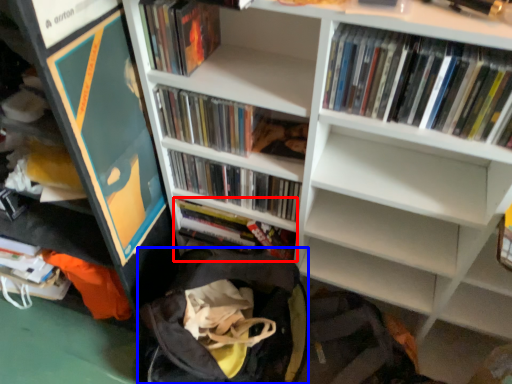
Question: Among these objects, which one is nearest to the camera, book (highlighted by a red box) or backpack (highlighted by a blue box)?

Choices:
 (A) book
 (B) backpack

Answer: (B)